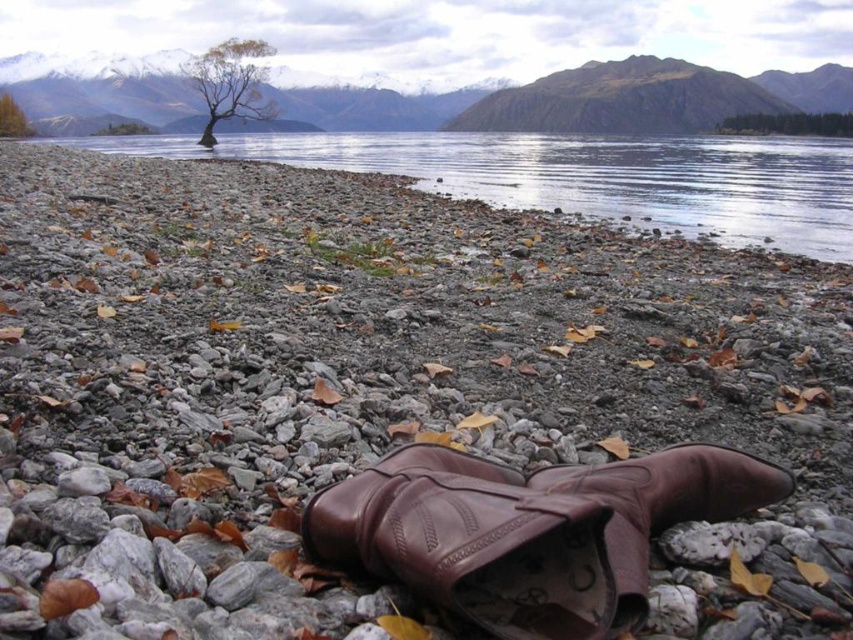
Question: Is clear water at shore center positioned behind green leafy tree at upper center?

Choices:
 (A) no
 (B) yes

Answer: (A)

Question: Does clear water at shore center have a smaller size compared to green leafy tree at upper center?

Choices:
 (A) yes
 (B) no

Answer: (B)

Question: Can you confirm if clear water at shore center is thinner than brown leafy tree at upper center?

Choices:
 (A) no
 (B) yes

Answer: (A)

Question: Based on their relative distances, which object is nearer to the brown leather boot at center?

Choices:
 (A) green leafy tree at center
 (B) green leafy tree at upper center
 (C) brown leafy tree at upper center

Answer: (C)

Question: Which point is farther to the camera?

Choices:
 (A) green leafy tree at upper right
 (B) brown leafy tree at upper center
 (C) clear water at shore center
 (D) green leafy tree at upper center

Answer: (A)

Question: Which of the following is the farthest from the observer?

Choices:
 (A) green leafy tree at upper center
 (B) clear water at shore center
 (C) green leafy tree at center

Answer: (C)